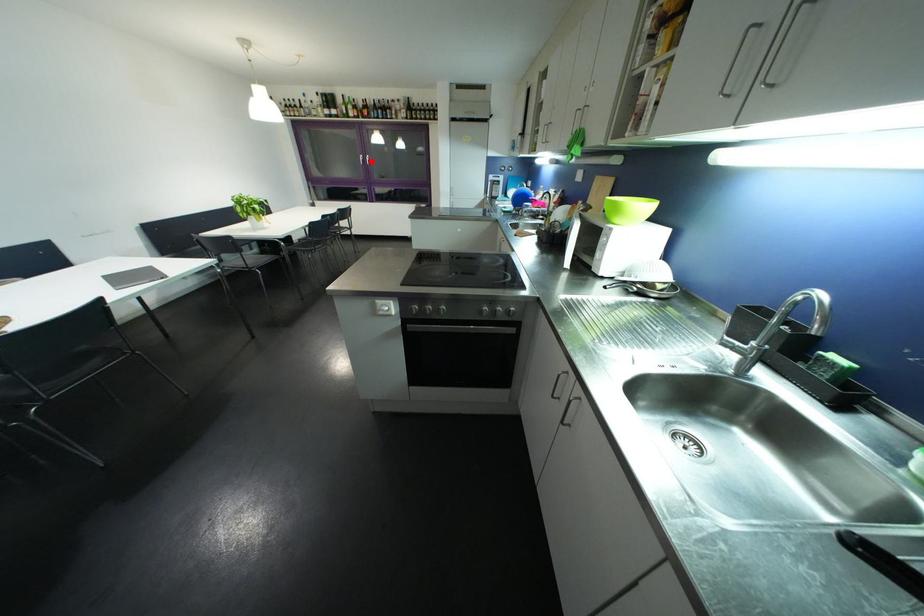
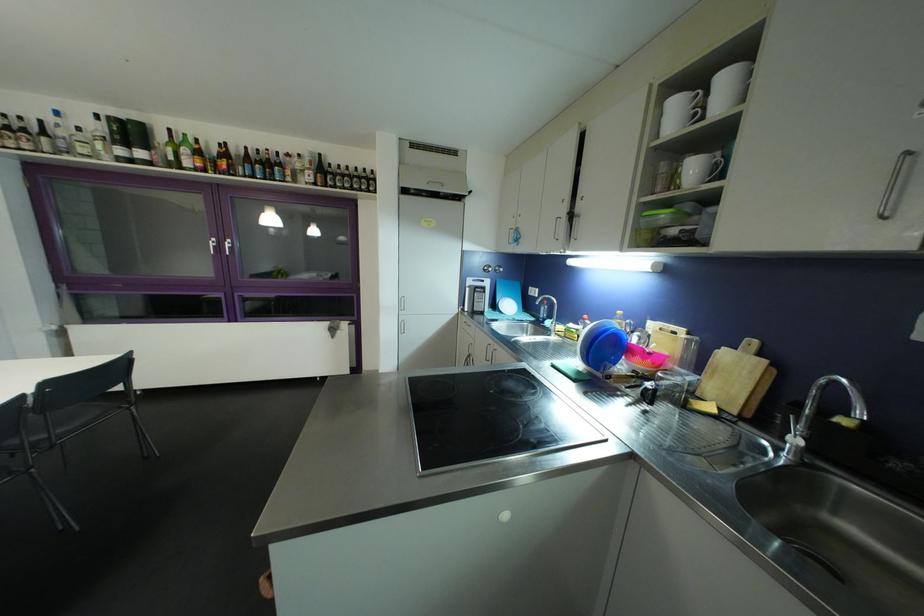
Question: I am providing you with two images of the same scene from different viewpoints. In image1, a red point is highlighted. Considering the same 3D point in image2, which of the following is correct?

Choices:
 (A) It is closer
 (B) It is farther

Answer: (B)